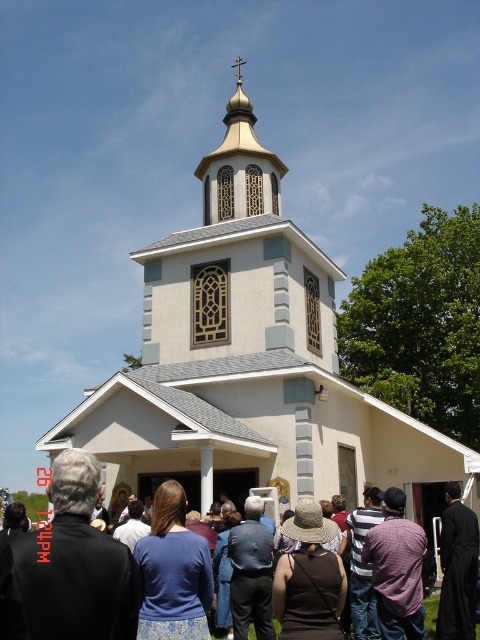
Question: Is white stucco church at center above brown fabric crowd at center?

Choices:
 (A) no
 (B) yes

Answer: (B)

Question: Does brown fabric crowd at center appear over gold textured dome at upper center?

Choices:
 (A) no
 (B) yes

Answer: (A)

Question: Which is farther from the gold textured dome at upper center?

Choices:
 (A) brown fabric crowd at center
 (B) white stucco church at center

Answer: (A)

Question: Where is brown fabric crowd at center located in relation to gold textured dome at upper center in the image?

Choices:
 (A) below
 (B) above

Answer: (A)

Question: Which object is the farthest from the gold textured dome at upper center?

Choices:
 (A) brown fabric crowd at center
 (B) white stucco church at center

Answer: (A)

Question: Which is nearer to the white stucco church at center?

Choices:
 (A) brown fabric crowd at center
 (B) gold textured dome at upper center

Answer: (A)